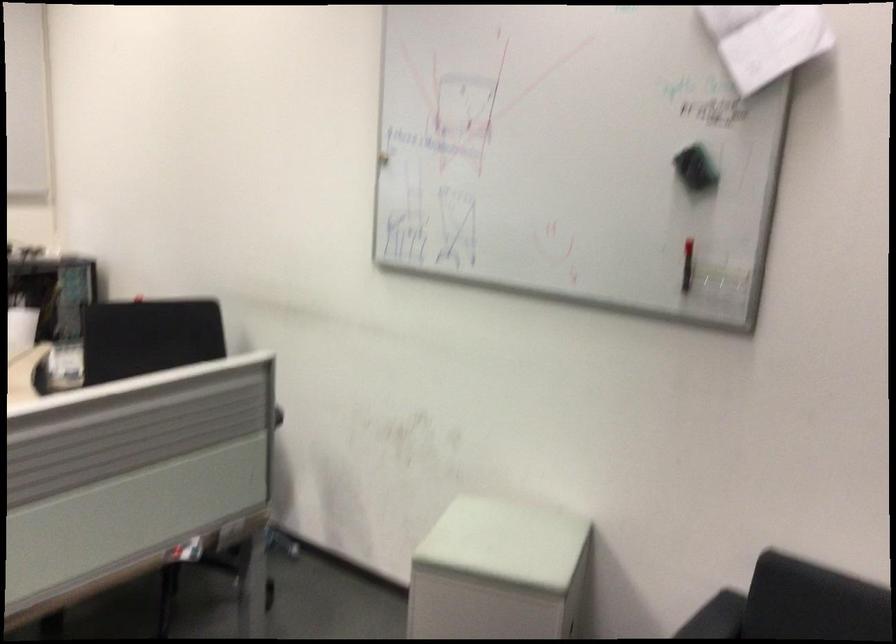
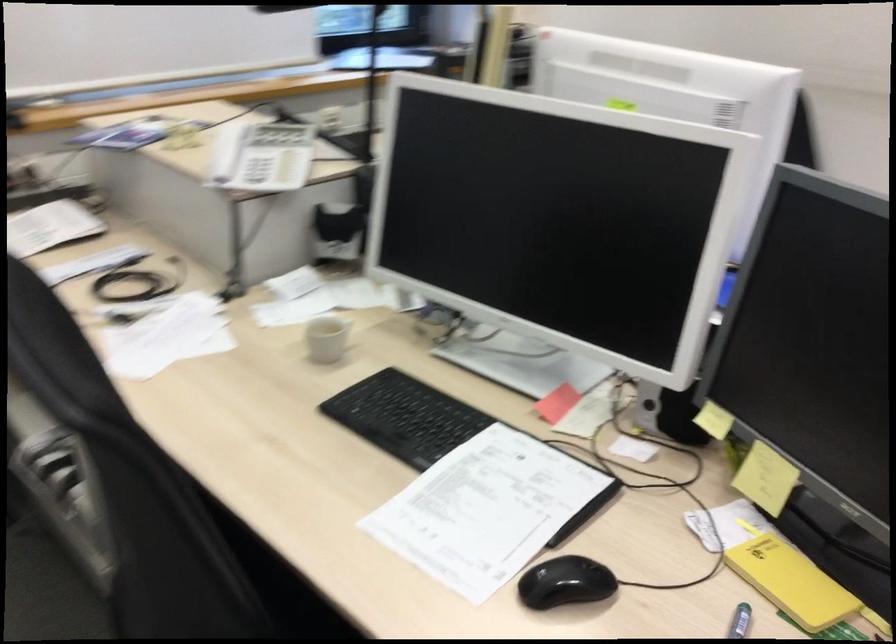
Question: What movement of the cameraman would produce the second image?

Choices:
 (A) Left
 (B) Right
 (C) Forward
 (D) Backward

Answer: (A)